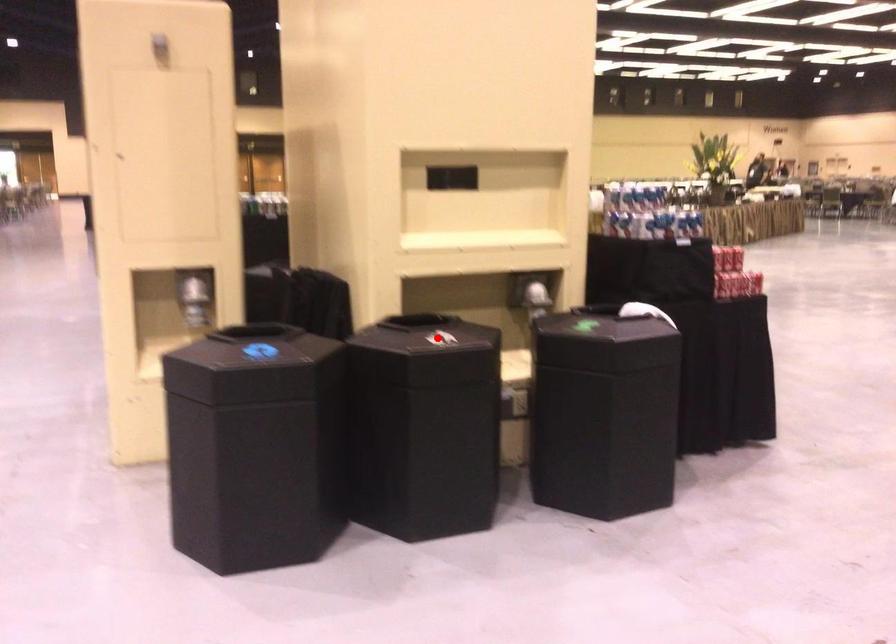
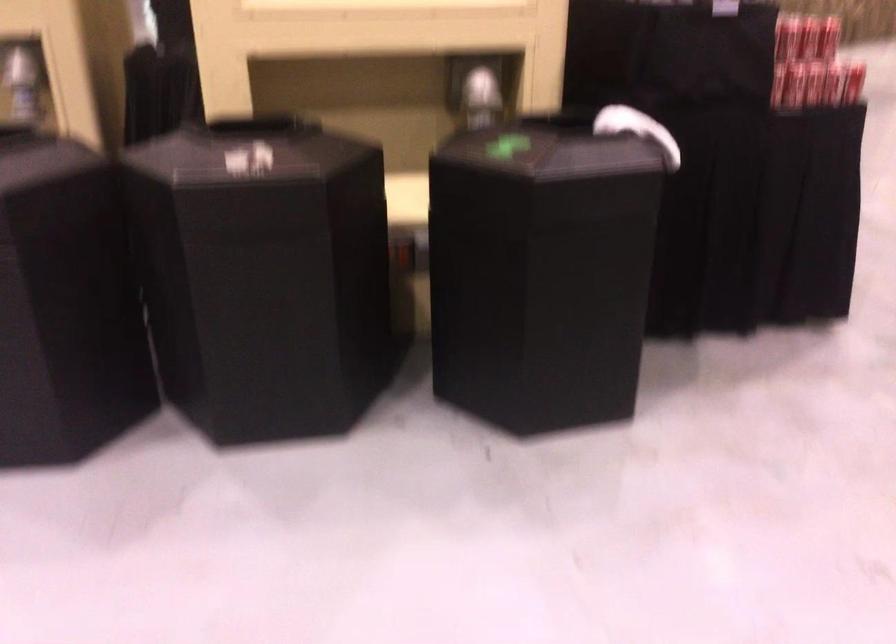
Question: I am providing you with two images of the same scene from different viewpoints. Given a red point in image1, look at the same physical point in image2. Is it:

Choices:
 (A) Closer to the viewpoint
 (B) Farther from the viewpoint

Answer: (A)